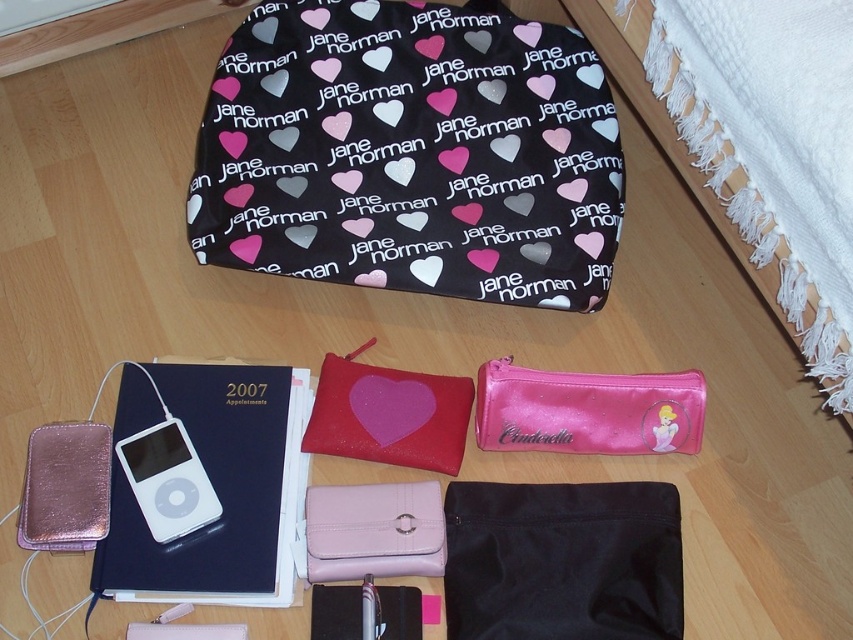
You are organizing your belongings and need to place the black fabric bag at upper center and the white glossy ipod at bottom left into a storage box. The box has a height limit of 12 inches. If the ipod is 2 inches tall, will the bag fit without exceeding the height limit?

The black fabric bag at upper center is much taller than the white glossy ipod at bottom left. Since the iPod is 2 inches tall, the bag exceeds this height, so it will not fit within the 12 inch height limit of the storage box.

You are organizing items on the floor and need to place a new item between the white glossy ipod at bottom left and the pink glittery heart at center. Based on their positions, where should you place the new item?

The white glossy ipod at bottom left is located below the pink glittery heart at center, so you should place the new item between them either above the ipod or below the heart, ensuring it is in the space between their current positions.